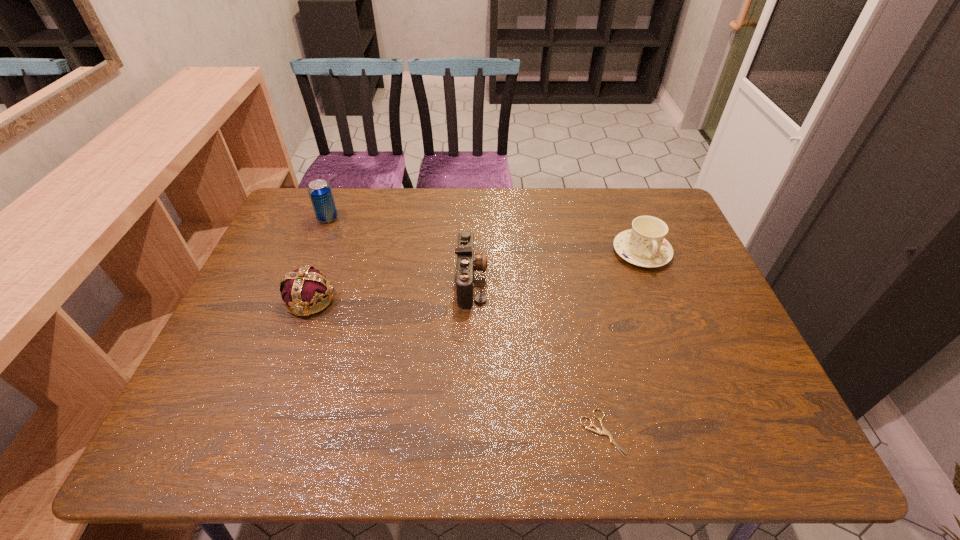
Find the location of a particular element. blank space located on the handle side of the chinaware is located at coordinates (660, 301).

The image size is (960, 540). What are the coordinates of `vacant space located on the back of the shears` in the screenshot? It's located at (575, 302).

Find the location of a particular element. object present at the far edge is located at coordinates (320, 193).

Identify the location of object located at the near edge. This screenshot has height=540, width=960. (604, 431).

The image size is (960, 540). Find the location of `beer can positioned at the left edge`. beer can positioned at the left edge is located at coordinates (320, 193).

In order to click on crown that is at the left edge in this screenshot , I will do `click(306, 286)`.

You are a GUI agent. You are given a task and a screenshot of the screen. Output one action in this format:
    pyautogui.click(x=<x>, y=<y>)
    Task: Click on the object present at the right edge
    The image size is (960, 540).
    Given the screenshot: What is the action you would take?
    pyautogui.click(x=644, y=245)

Where is `object located at the far left corner`? object located at the far left corner is located at coordinates (320, 193).

Where is `vacant region at the far edge`? The image size is (960, 540). vacant region at the far edge is located at coordinates (353, 201).

Locate an element on the screen. vacant space at the near edge of the desktop is located at coordinates (295, 444).